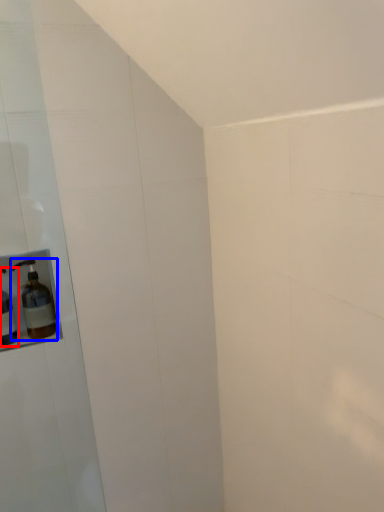
Question: Which object appears farthest to the camera in this image, bottle (highlighted by a red box) or bottle (highlighted by a blue box)?

Choices:
 (A) bottle
 (B) bottle

Answer: (B)